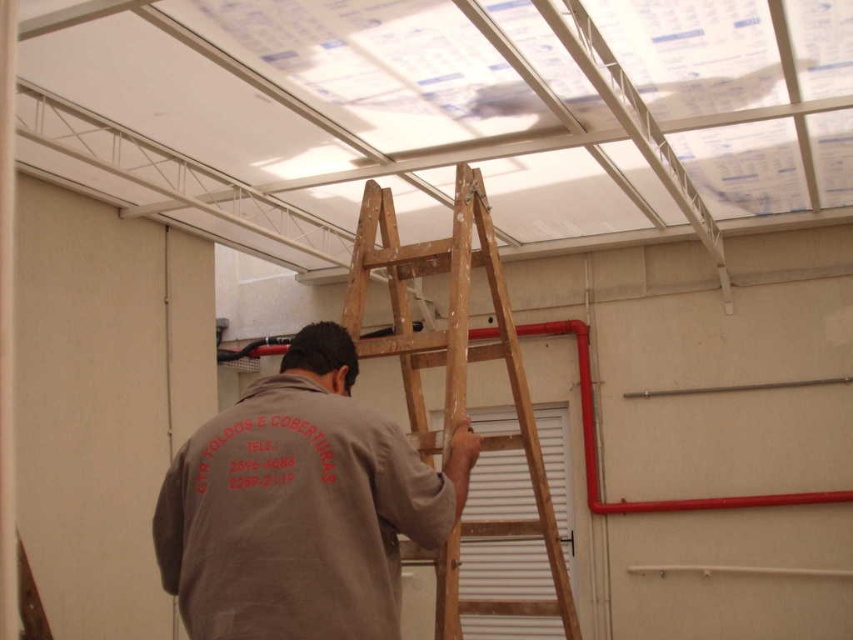
Which of these two, brown cotton shirt at center or wooden at upper center, stands shorter?

With less height is brown cotton shirt at center.

Measure the distance from brown cotton shirt at center to wooden at upper center.

brown cotton shirt at center and wooden at upper center are 29.48 inches apart.

Is point (248, 417) positioned behind point (457, 588)?

No, it is in front of (457, 588).

At what (x,y) coordinates should I click in order to perform the action: click on brown cotton shirt at center. Please return your answer as a coordinate pair (x, y). The width and height of the screenshot is (853, 640). Looking at the image, I should click on (300, 506).